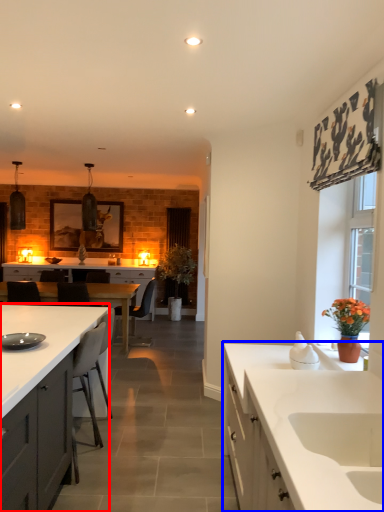
Question: Among these objects, which one is farthest to the camera, cabinetry (highlighted by a red box) or countertop (highlighted by a blue box)?

Choices:
 (A) cabinetry
 (B) countertop

Answer: (B)